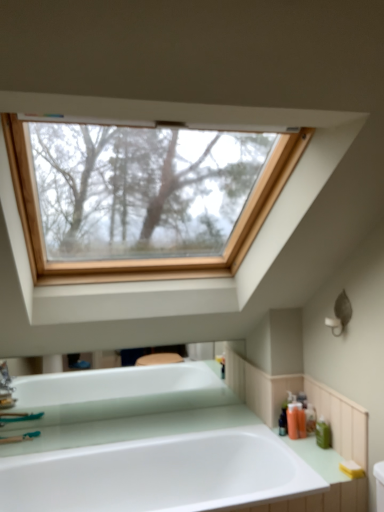
At what (x,y) coordinates should I click in order to perform the action: click on vacant space in front of green matte bottle at right, the first toiletry in the front-to-back sequence. Please return your answer as a coordinate pair (x, y). The image size is (384, 512). Looking at the image, I should click on (325, 463).